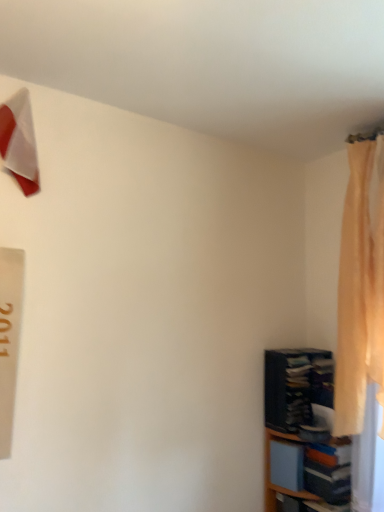
What is the approximate width of wooden bookshelf at lower right?

wooden bookshelf at lower right is 9.96 inches wide.

This screenshot has height=512, width=384. Describe the element at coordinates (360, 290) in the screenshot. I see `silky beige curtain at right` at that location.

Locate an element on the screen. Image resolution: width=384 pixels, height=512 pixels. white glossy triangle at upper left is located at coordinates [19, 142].

What do you see at coordinates (19, 142) in the screenshot?
I see `white glossy triangle at upper left` at bounding box center [19, 142].

This screenshot has width=384, height=512. Identify the location of dark blue fabric bookshelf at lower right. (296, 386).

Can you tell me how much dark blue fabric bookshelf at lower right and wooden bookshelf at lower right differ in facing direction?

4.19 degrees.

Which object is closer to the camera taking this photo, dark blue fabric bookshelf at lower right or wooden bookshelf at lower right?

wooden bookshelf at lower right is in front.

Is dark blue fabric bookshelf at lower right surrounding wooden bookshelf at lower right?

No.

Looking at this image, from a real-world perspective, which is physically above, dark blue fabric bookshelf at lower right or wooden bookshelf at lower right?

dark blue fabric bookshelf at lower right.

Who is smaller, silky beige curtain at right or white glossy triangle at upper left?

white glossy triangle at upper left.

From the image's perspective, is silky beige curtain at right below white glossy triangle at upper left?

Correct, silky beige curtain at right appears lower than white glossy triangle at upper left in the image.

From the picture: Is silky beige curtain at right wider than white glossy triangle at upper left?

Correct, the width of silky beige curtain at right exceeds that of white glossy triangle at upper left.

Can you tell me how much silky beige curtain at right and white glossy triangle at upper left differ in facing direction?

silky beige curtain at right and white glossy triangle at upper left are facing 92.7 degrees away from each other.

From the image's perspective, which one is positioned lower, dark blue fabric bookshelf at lower right or silky beige curtain at right?

dark blue fabric bookshelf at lower right, from the image's perspective.

Locate an element on the screen. This screenshot has width=384, height=512. curtain in front of the dark blue fabric bookshelf at lower right is located at coordinates (360, 290).

Is the depth of dark blue fabric bookshelf at lower right less than that of silky beige curtain at right?

No.

Does dark blue fabric bookshelf at lower right touch silky beige curtain at right?

No, dark blue fabric bookshelf at lower right is not making contact with silky beige curtain at right.

Is dark blue fabric bookshelf at lower right oriented away from white glossy triangle at upper left?

No, dark blue fabric bookshelf at lower right's orientation is not away from white glossy triangle at upper left.

Are dark blue fabric bookshelf at lower right and white glossy triangle at upper left far apart?

Yes, dark blue fabric bookshelf at lower right and white glossy triangle at upper left are quite far apart.

I want to click on twin that appears above the dark blue fabric bookshelf at lower right (from the image's perspective), so click(x=19, y=142).

Which is in front, point (313, 373) or point (13, 120)?

The point (13, 120) is more forward.

Consider the image. Is silky beige curtain at right completely or partially inside white glossy triangle at upper left?

No, silky beige curtain at right is not inside white glossy triangle at upper left.

From a real-world perspective, which is physically below, white glossy triangle at upper left or silky beige curtain at right?

silky beige curtain at right, from a real-world perspective.

Considering the positions of point (6, 121) and point (345, 331), is point (6, 121) closer or farther from the camera than point (345, 331)?

Point (6, 121).

Could you tell me if white glossy triangle at upper left is facing silky beige curtain at right?

No, white glossy triangle at upper left is not aimed at silky beige curtain at right.

Considering the sizes of white glossy triangle at upper left and wooden bookshelf at lower right in the image, is white glossy triangle at upper left wider or thinner than wooden bookshelf at lower right?

Considering their sizes, white glossy triangle at upper left looks slimmer than wooden bookshelf at lower right.

From a real-world perspective, is white glossy triangle at upper left positioned over wooden bookshelf at lower right based on gravity?

Yes, from a real-world perspective, white glossy triangle at upper left is above wooden bookshelf at lower right.

Based on the photo, is white glossy triangle at upper left far from wooden bookshelf at lower right?

Yes.

Is point (280, 436) positioned after point (272, 412)?

No.

Can you tell me how much wooden bookshelf at lower right and dark blue fabric bookshelf at lower right differ in facing direction?

The angular difference between wooden bookshelf at lower right and dark blue fabric bookshelf at lower right is 4.19 degrees.

Is wooden bookshelf at lower right bigger or smaller than dark blue fabric bookshelf at lower right?

wooden bookshelf at lower right is bigger than dark blue fabric bookshelf at lower right.

From the image's perspective, is wooden bookshelf at lower right located above or below dark blue fabric bookshelf at lower right?

From the image's perspective, wooden bookshelf at lower right appears below dark blue fabric bookshelf at lower right.

At what (x,y) coordinates should I click in order to perform the action: click on shelf below the dark blue fabric bookshelf at lower right (from a real-world perspective). Please return your answer as a coordinate pair (x, y). This screenshot has height=512, width=384. Looking at the image, I should click on (302, 430).

This screenshot has height=512, width=384. Find the location of `twin on the left of the silky beige curtain at right`. twin on the left of the silky beige curtain at right is located at coordinates (19, 142).

Estimate the real-world distances between objects in this image. Which object is closer to wooden bookshelf at lower right, white glossy triangle at upper left or silky beige curtain at right?

The object closer to wooden bookshelf at lower right is silky beige curtain at right.

Estimate the real-world distances between objects in this image. Which object is further from silky beige curtain at right, dark blue fabric bookshelf at lower right or white glossy triangle at upper left?

white glossy triangle at upper left is further to silky beige curtain at right.

When comparing their distances from white glossy triangle at upper left, does wooden bookshelf at lower right or dark blue fabric bookshelf at lower right seem closer?

Based on the image, dark blue fabric bookshelf at lower right appears to be nearer to white glossy triangle at upper left.

Considering their positions, is wooden bookshelf at lower right positioned closer to white glossy triangle at upper left than silky beige curtain at right?

silky beige curtain at right is positioned closer to the anchor white glossy triangle at upper left.

Considering their positions, is silky beige curtain at right positioned further to dark blue fabric bookshelf at lower right than white glossy triangle at upper left?

white glossy triangle at upper left is further to dark blue fabric bookshelf at lower right.

Considering their positions, is dark blue fabric bookshelf at lower right positioned further to wooden bookshelf at lower right than silky beige curtain at right?

The object further to wooden bookshelf at lower right is silky beige curtain at right.

Which object lies nearer to the anchor point wooden bookshelf at lower right, white glossy triangle at upper left or dark blue fabric bookshelf at lower right?

dark blue fabric bookshelf at lower right.

Based on their spatial positions, is white glossy triangle at upper left or wooden bookshelf at lower right further from dark blue fabric bookshelf at lower right?

white glossy triangle at upper left is positioned further to the anchor dark blue fabric bookshelf at lower right.

This screenshot has height=512, width=384. Find the location of `book between white glossy triangle at upper left and wooden bookshelf at lower right from top to bottom`. book between white glossy triangle at upper left and wooden bookshelf at lower right from top to bottom is located at coordinates (296, 386).

The image size is (384, 512). What are the coordinates of `shelf situated between white glossy triangle at upper left and silky beige curtain at right from left to right` in the screenshot? It's located at (302, 430).

Where is `book located between white glossy triangle at upper left and silky beige curtain at right in the left-right direction`? This screenshot has height=512, width=384. book located between white glossy triangle at upper left and silky beige curtain at right in the left-right direction is located at coordinates (296, 386).

Where is `book between silky beige curtain at right and wooden bookshelf at lower right in the vertical direction`? This screenshot has height=512, width=384. book between silky beige curtain at right and wooden bookshelf at lower right in the vertical direction is located at coordinates (296, 386).